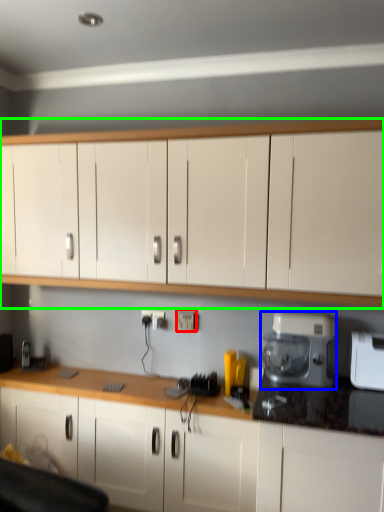
Question: Which is nearer to the electric outlet (highlighted by a red box)? home appliance (highlighted by a blue box) or cabinetry (highlighted by a green box).

Choices:
 (A) home appliance
 (B) cabinetry

Answer: (A)